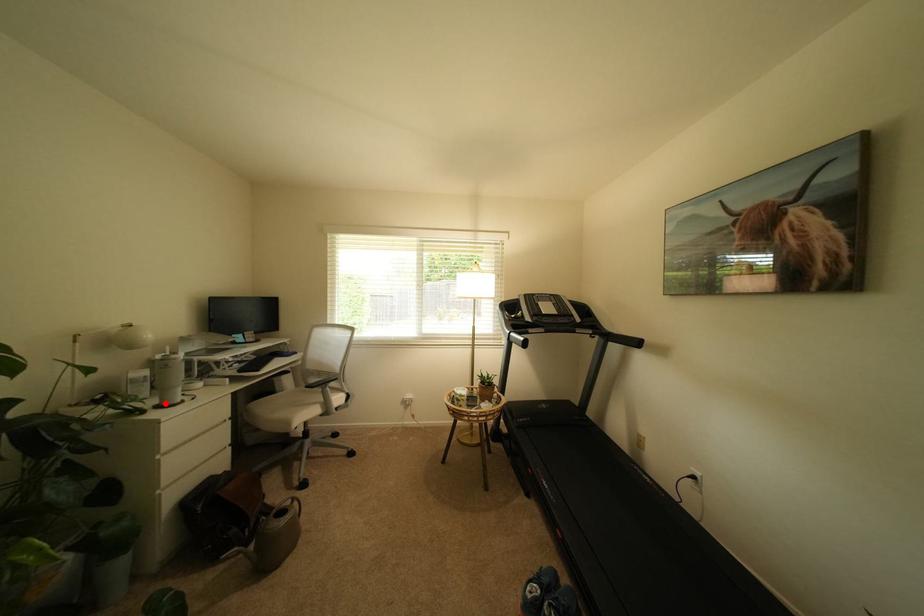
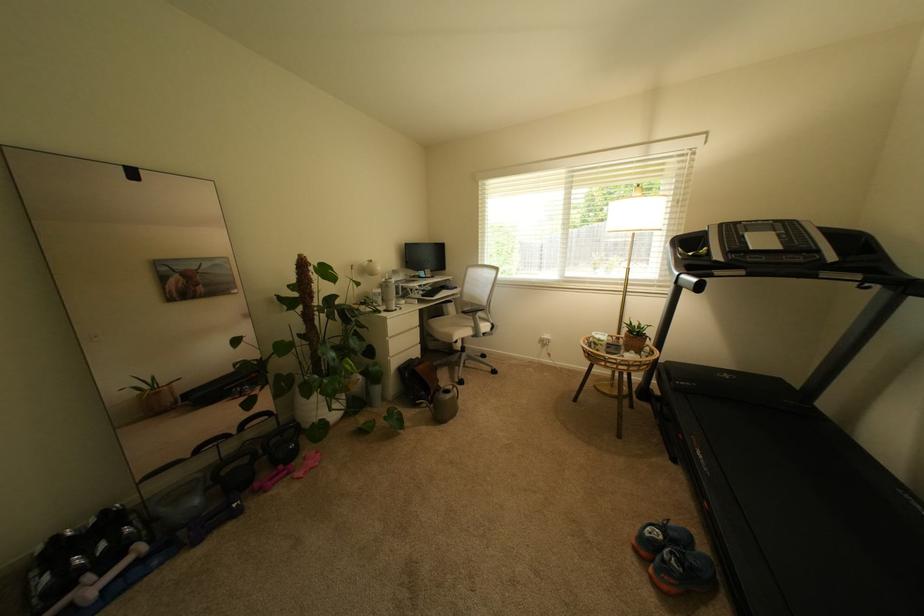
The point at the highlighted location is marked in the first image. Where is the corresponding point in the second image?

(393, 310)